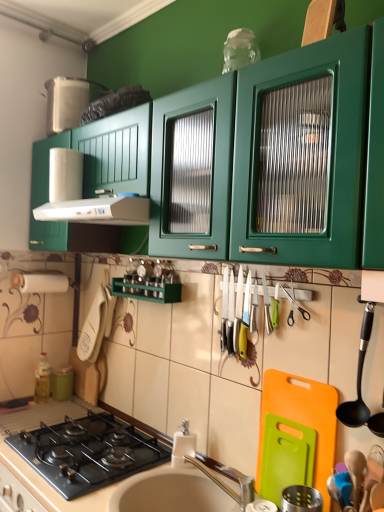
Question: Is white glossy sink at lower center not within black plastic spoon at right, which ranks as the second utensil in bottom-to-top order?

Choices:
 (A) no
 (B) yes

Answer: (B)

Question: Can you confirm if white glossy sink at lower center is shorter than black plastic spoon at right, which appears as the first utensil when viewed from the top?

Choices:
 (A) no
 (B) yes

Answer: (B)

Question: Considering the relative positions of white glossy sink at lower center and black plastic spoon at right, which ranks as the second utensil in bottom-to-top order, in the image provided, is white glossy sink at lower center behind black plastic spoon at right, which ranks as the second utensil in bottom-to-top order,?

Choices:
 (A) no
 (B) yes

Answer: (A)

Question: Is white glossy sink at lower center at the left side of black plastic spoon at right, which appears as the first utensil when viewed from the top?

Choices:
 (A) yes
 (B) no

Answer: (A)

Question: Is white glossy sink at lower center placed right next to black plastic spoon at right, which appears as the first utensil when viewed from the top?

Choices:
 (A) yes
 (B) no

Answer: (B)

Question: Is white glossy sink at lower center looking in the opposite direction of black plastic spoon at right, which ranks as the second utensil in bottom-to-top order?

Choices:
 (A) yes
 (B) no

Answer: (B)

Question: Is green matte canister at lower left, the 3th appliance when ordered from front to back, looking in the opposite direction of green plastic cutting board at lower right, the 2th appliance from the left?

Choices:
 (A) no
 (B) yes

Answer: (A)

Question: Are green matte canister at lower left, which is the first appliance in back-to-front order, and green plastic cutting board at lower right, the 2th appliance from the left, beside each other?

Choices:
 (A) yes
 (B) no

Answer: (B)

Question: Is green matte canister at lower left, which appears as the 1th appliance when viewed from the left, not within green plastic cutting board at lower right, the 2th appliance positioned from the back?

Choices:
 (A) yes
 (B) no

Answer: (A)

Question: Does green matte canister at lower left, the 3th appliance when ordered from front to back, have a lesser height compared to green plastic cutting board at lower right, acting as the second appliance starting from the right?

Choices:
 (A) yes
 (B) no

Answer: (A)

Question: Considering the relative sizes of green matte canister at lower left, which is the first appliance in back-to-front order, and green plastic cutting board at lower right, which is counted as the 2th appliance, starting from the front, in the image provided, is green matte canister at lower left, which is the first appliance in back-to-front order, smaller than green plastic cutting board at lower right, which is counted as the 2th appliance, starting from the front,?

Choices:
 (A) no
 (B) yes

Answer: (B)

Question: Is green matte canister at lower left, the 3th appliance when ordered from front to back, behind green plastic cutting board at lower right, the 2th appliance from the left?

Choices:
 (A) yes
 (B) no

Answer: (A)

Question: Does silver metallic faucet at sink center appear on the right side of white plastic exhaust hood at upper left?

Choices:
 (A) no
 (B) yes

Answer: (B)